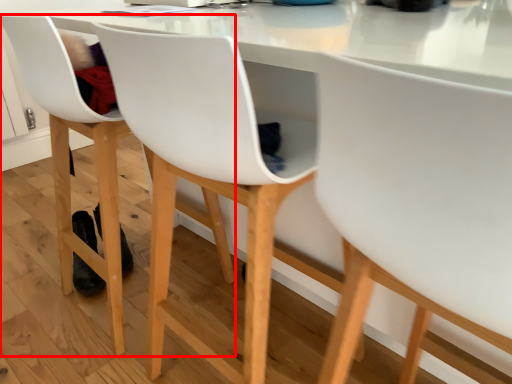
Question: From the image's perspective, what is the correct spatial relationship of chair (annotated by the red box) in relation to chair?

Choices:
 (A) below
 (B) above

Answer: (B)